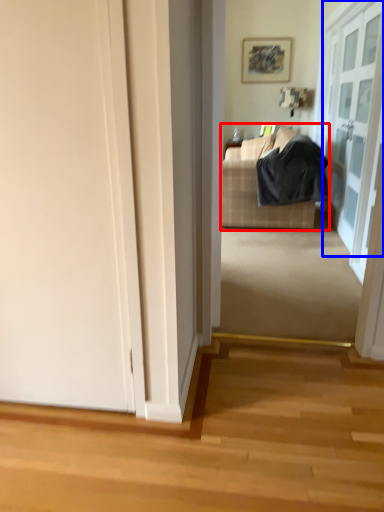
Question: Which of the following is the farthest to the observer, studio couch (highlighted by a red box) or door (highlighted by a blue box)?

Choices:
 (A) studio couch
 (B) door

Answer: (A)